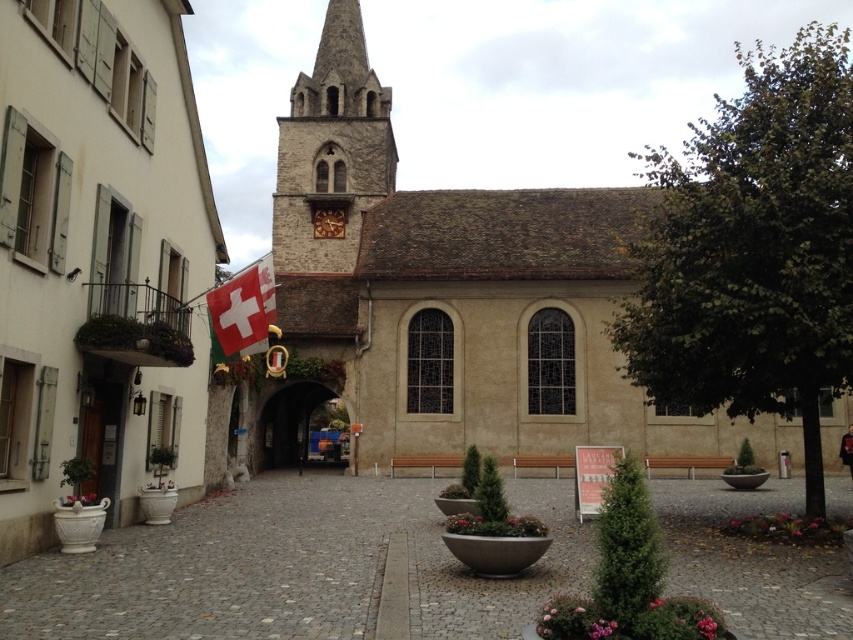
Question: Does gray cobblestone alley at center have a larger size compared to white fabric flag at lower left?

Choices:
 (A) yes
 (B) no

Answer: (A)

Question: Which of these objects is positioned closest to the beige stone church at center?

Choices:
 (A) white fabric flag at lower left
 (B) stone clock tower at center
 (C) gray cobblestone alley at center

Answer: (B)

Question: Which point is closer to the camera?

Choices:
 (A) beige stone church at center
 (B) gray cobblestone alley at center

Answer: (B)

Question: Can you confirm if gray cobblestone alley at center is positioned to the right of stone clock tower at center?

Choices:
 (A) no
 (B) yes

Answer: (B)

Question: Can you confirm if stone clock tower at center is positioned to the left of white fabric flag at lower left?

Choices:
 (A) no
 (B) yes

Answer: (B)

Question: Which point is farther to the camera?

Choices:
 (A) (323, 234)
 (B) (349, 371)

Answer: (A)